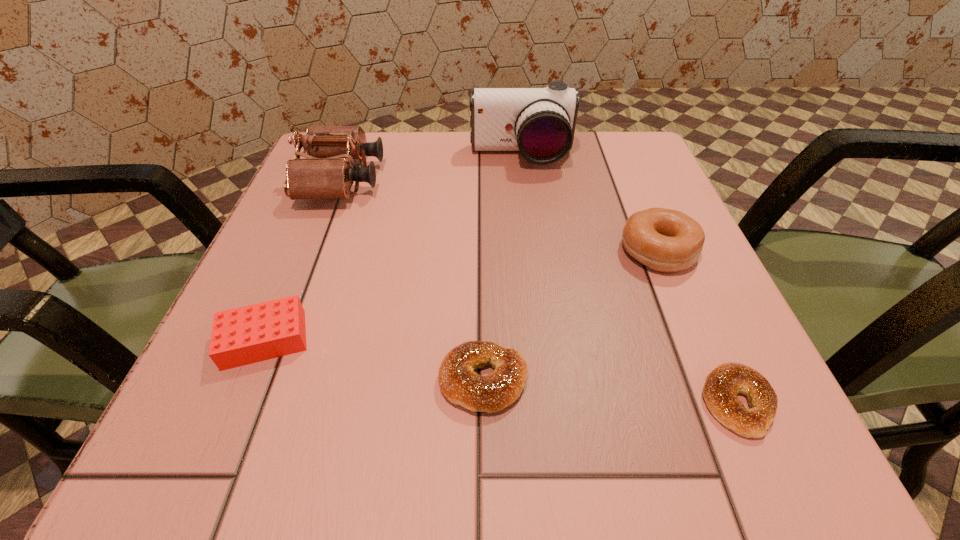
Locate an element on the screen. The width and height of the screenshot is (960, 540). free spot located on the front of the tallest bagel is located at coordinates pos(683,311).

Where is `free space located on the right of the fourth tallest object`? free space located on the right of the fourth tallest object is located at coordinates (517, 340).

You are a GUI agent. You are given a task and a screenshot of the screen. Output one action in this format:
    pyautogui.click(x=<x>, y=<y>)
    Task: Click on the vacant region located 0.190m on the left of the second tallest bagel
    The width and height of the screenshot is (960, 540).
    Given the screenshot: What is the action you would take?
    pyautogui.click(x=293, y=380)

Where is `vacant space located 0.230m on the back of the shortest bagel`? The width and height of the screenshot is (960, 540). vacant space located 0.230m on the back of the shortest bagel is located at coordinates (671, 252).

Where is `camcorder that is positioned at the far edge`? The image size is (960, 540). camcorder that is positioned at the far edge is located at coordinates (539, 122).

This screenshot has width=960, height=540. Find the location of `binoculars that is at the far edge`. binoculars that is at the far edge is located at coordinates pyautogui.click(x=327, y=173).

Locate an element on the screen. binoculars that is positioned at the left edge is located at coordinates (327, 173).

Where is `Lego that is at the left edge`? The width and height of the screenshot is (960, 540). Lego that is at the left edge is located at coordinates (249, 334).

I want to click on object at the far left corner, so click(x=327, y=173).

Image resolution: width=960 pixels, height=540 pixels. Find the location of `object that is at the near right corner`. object that is at the near right corner is located at coordinates (722, 384).